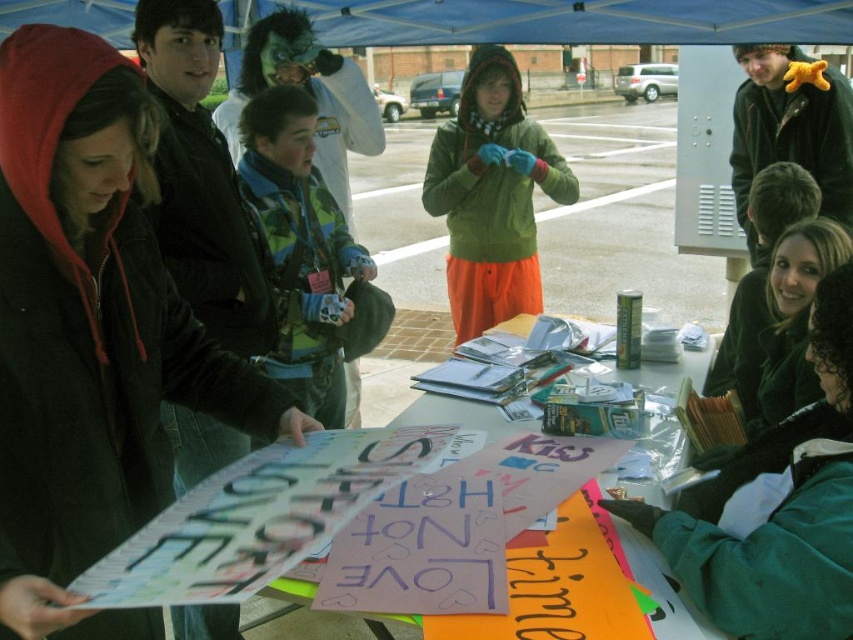
Question: Is the position of black hoodie at left more distant than that of green matte jacket at center?

Choices:
 (A) no
 (B) yes

Answer: (A)

Question: Is blue fabric canopy at upper center below green matte jacket at center?

Choices:
 (A) no
 (B) yes

Answer: (A)

Question: Which point is closer to the camera?

Choices:
 (A) (389, 400)
 (B) (759, 10)

Answer: (B)

Question: Is black hoodie at left below blue fabric canopy at upper center?

Choices:
 (A) no
 (B) yes

Answer: (B)

Question: Which point is farther to the camera?

Choices:
 (A) 492,38
 (B) 503,324

Answer: (A)

Question: Which is nearer to the black hoodie at left?

Choices:
 (A) blue fabric canopy at upper center
 (B) cardboard posters at center

Answer: (A)